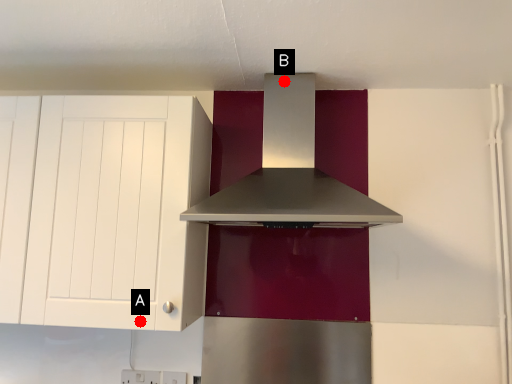
Question: Two points are circled on the image, labeled by A and B beside each circle. Which point appears farthest from the camera in this image?

Choices:
 (A) A is further
 (B) B is further

Answer: (B)